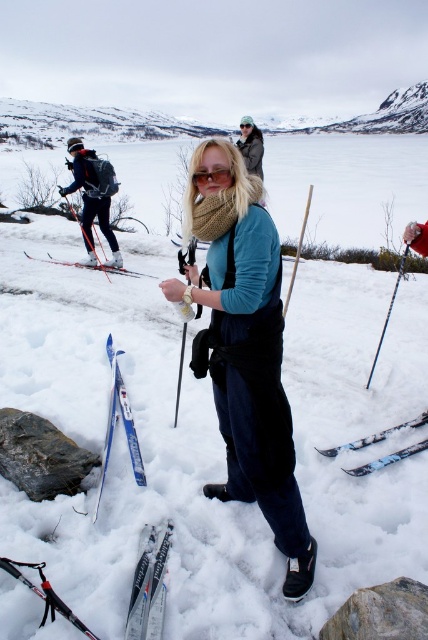
Question: Which point appears closest to the camera in this image?

Choices:
 (A) (163, 566)
 (B) (55, 604)
 (C) (136, 449)
 (D) (222, 176)

Answer: (D)

Question: Where is matte black backpack at left located in relation to light brown fur coat at center in the image?

Choices:
 (A) left
 (B) right

Answer: (A)

Question: Can you confirm if blue metallic ski at lower left is smaller than white plastic ski at left?

Choices:
 (A) yes
 (B) no

Answer: (B)

Question: Considering the real-world distances, which object is closest to the white plastic ski at left?

Choices:
 (A) matte black ski pole at lower left
 (B) metallic silver ski pole at center
 (C) blue metallic ski at lower left

Answer: (C)

Question: Which point is closer to the camera taking this photo?

Choices:
 (A) (240, 124)
 (B) (246, 157)

Answer: (B)

Question: Can you confirm if knitted wool scarf at center is smaller than white plastic ski at left?

Choices:
 (A) no
 (B) yes

Answer: (A)